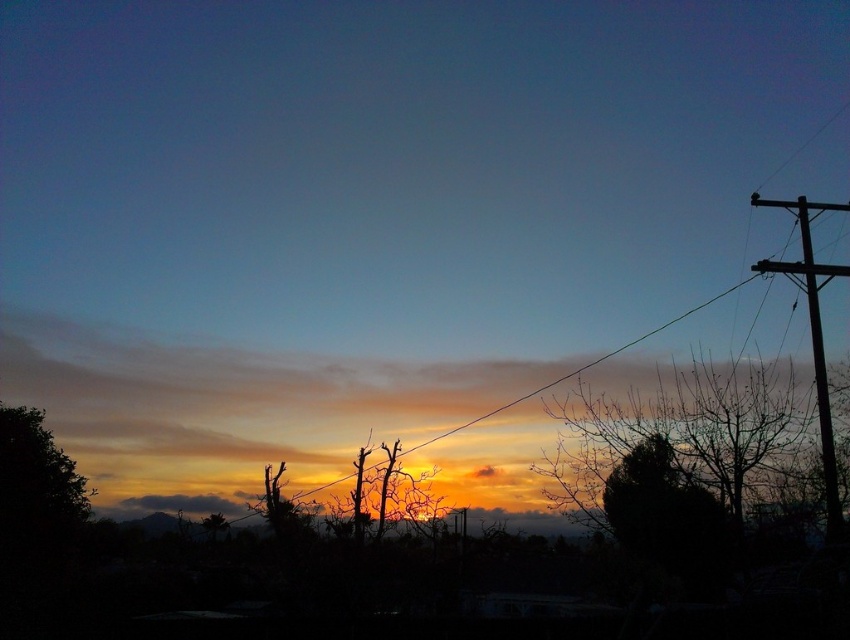
You are a bird flying towards the brown wooden telegraph pole at right and the green wire at center. Which object will you encounter first?

The brown wooden telegraph pole at right is located above the green wire at center, so you will encounter the green wire at center first before reaching the brown wooden telegraph pole at right.

You are standing in the middle of the road and see the brown wooden telegraph pole at right and the green wire at center. Which object is positioned to the right of the other?

The brown wooden telegraph pole at right is positioned to the right of the green wire at center.